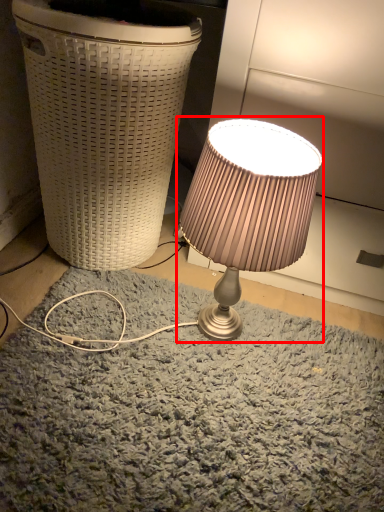
Question: Considering the relative positions of lamp (annotated by the red box) and waste container in the image provided, where is lamp (annotated by the red box) located with respect to the staircase?

Choices:
 (A) right
 (B) left

Answer: (A)